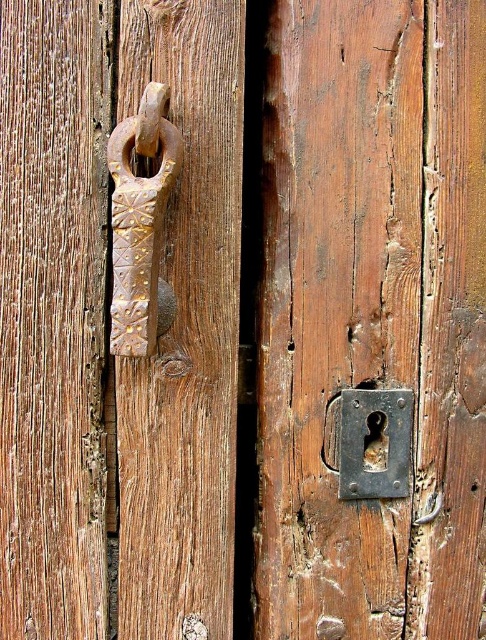
Question: Which point appears closest to the camera in this image?

Choices:
 (A) (383, 468)
 (B) (150, 301)

Answer: (B)

Question: Which point is farther to the camera?

Choices:
 (A) (128, 300)
 (B) (358, 404)

Answer: (B)

Question: Is rusty metal door handle at left closer to camera compared to rusty metal keyhole at lower right?

Choices:
 (A) no
 (B) yes

Answer: (B)

Question: Can you confirm if rusty metal door handle at left is positioned to the right of rusty metal keyhole at lower right?

Choices:
 (A) yes
 (B) no

Answer: (B)

Question: Can you confirm if rusty metal door handle at left is positioned below rusty metal keyhole at lower right?

Choices:
 (A) yes
 (B) no

Answer: (B)

Question: Which object appears farthest from the camera in this image?

Choices:
 (A) rusty metal door handle at left
 (B) rusty metal keyhole at lower right

Answer: (B)